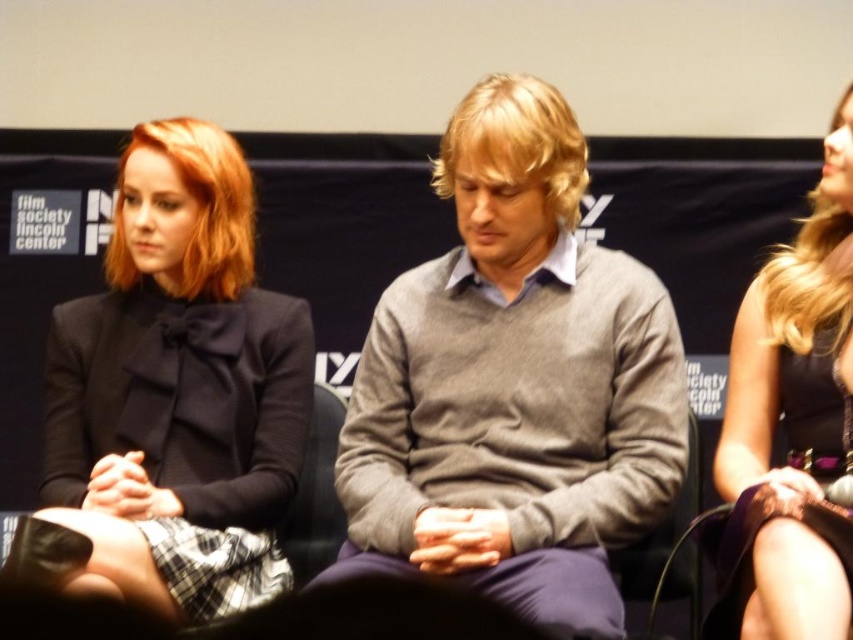
Does point (376, 304) lie behind point (115, 412)?

Yes, point (376, 304) is behind point (115, 412).

Who is lower down, gray sweater at center or matte black dress at left?

matte black dress at left is below.

What do you see at coordinates (514, 385) in the screenshot? I see `gray sweater at center` at bounding box center [514, 385].

Identify the location of gray sweater at center. (514, 385).

Who is higher up, gray sweater at center or satin black dress at center?

gray sweater at center is higher up.

Can you confirm if gray sweater at center is positioned to the right of satin black dress at center?

No, gray sweater at center is not to the right of satin black dress at center.

Where is `gray sweater at center`? gray sweater at center is located at coordinates (514, 385).

Can you confirm if matte black dress at left is smaller than satin black dress at center?

No.

Does matte black dress at left lie in front of satin black dress at center?

No, matte black dress at left is further to the viewer.

At what (x,y) coordinates should I click in order to perform the action: click on matte black dress at left. Please return your answer as a coordinate pair (x, y). Looking at the image, I should click on (178, 388).